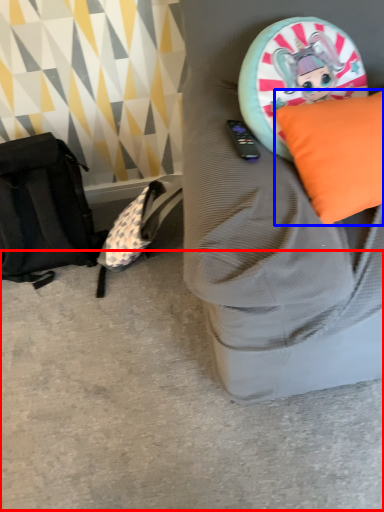
Question: Among these objects, which one is farthest to the camera, concrete (highlighted by a red box) or pillow (highlighted by a blue box)?

Choices:
 (A) concrete
 (B) pillow

Answer: (A)